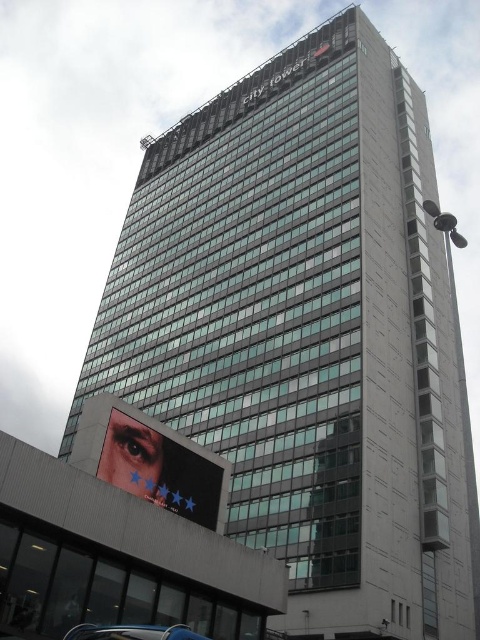
Question: Which point is closer to the camera taking this photo?

Choices:
 (A) (119, 465)
 (B) (148, 625)

Answer: (B)

Question: Can you confirm if matte black eye at lower left is smaller than metallic blue car at lower left?

Choices:
 (A) yes
 (B) no

Answer: (B)

Question: Which point is farther from the camera taking this photo?

Choices:
 (A) (176, 628)
 (B) (106, 448)

Answer: (B)

Question: Observing the image, what is the correct spatial positioning of matte black eye at lower left in reference to metallic blue car at lower left?

Choices:
 (A) right
 (B) left

Answer: (A)

Question: Is matte black eye at lower left above metallic blue car at lower left?

Choices:
 (A) yes
 (B) no

Answer: (A)